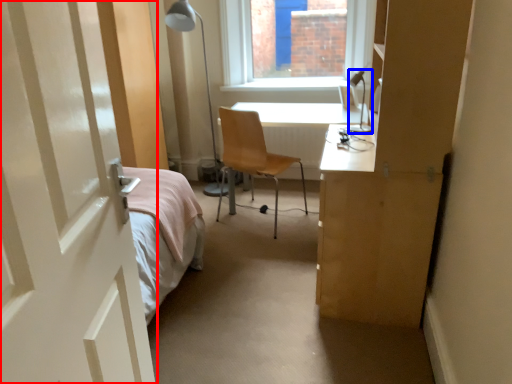
Question: Among these objects, which one is farthest to the camera, door (highlighted by a red box) or table lamp (highlighted by a blue box)?

Choices:
 (A) door
 (B) table lamp

Answer: (B)